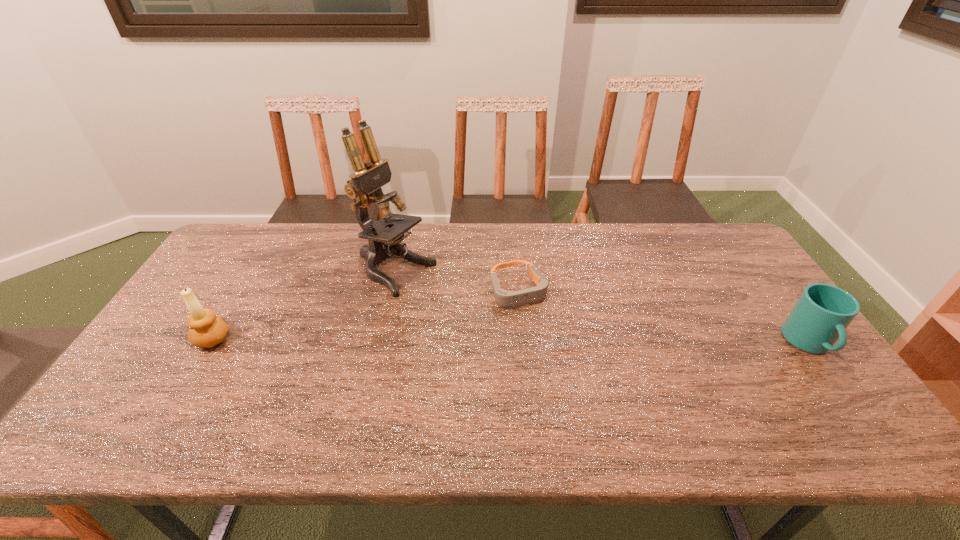
You are a GUI agent. You are given a task and a screenshot of the screen. Output one action in this format:
    pyautogui.click(x=<x>, y=<y>)
    Task: Click on the vacant area located 0.140m on the front and back of the second object from right to left
    The image size is (960, 540).
    Given the screenshot: What is the action you would take?
    pyautogui.click(x=547, y=343)

You are a GUI agent. You are given a task and a screenshot of the screen. Output one action in this format:
    pyautogui.click(x=<x>, y=<y>)
    Task: Click on the free region located 0.100m on the front and back of the second object from right to left
    Image resolution: width=960 pixels, height=540 pixels.
    Given the screenshot: What is the action you would take?
    pyautogui.click(x=541, y=333)

Where is `vacant area situated on the front and back of the second object from right to left`? vacant area situated on the front and back of the second object from right to left is located at coordinates (552, 352).

Identify the location of vacant area situated 0.310m at the eyepieces of the microscope. (514, 329).

Where is `vacant area situated at the eyepieces of the microscope`? vacant area situated at the eyepieces of the microscope is located at coordinates (475, 310).

Locate an element on the screen. This screenshot has height=540, width=960. vacant region located 0.370m at the eyepieces of the microscope is located at coordinates (533, 338).

This screenshot has width=960, height=540. Find the location of `object that is at the far edge`. object that is at the far edge is located at coordinates (364, 186).

Image resolution: width=960 pixels, height=540 pixels. Find the location of `object located at the left edge`. object located at the left edge is located at coordinates (206, 330).

At what (x,y) coordinates should I click in order to perform the action: click on object positioned at the right edge. Please return your answer as a coordinate pair (x, y). The image size is (960, 540). Looking at the image, I should click on (820, 317).

The width and height of the screenshot is (960, 540). In order to click on free space at the far edge of the desktop in this screenshot , I will do `click(658, 251)`.